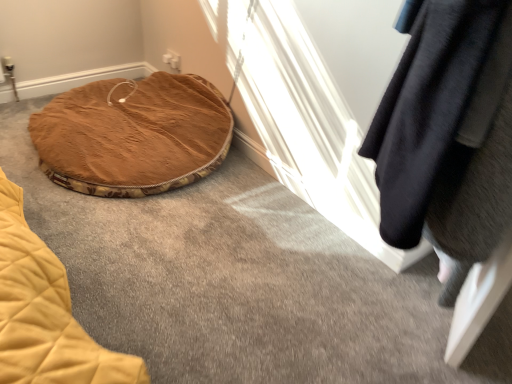
Question: In terms of height, does brown plush pet bed at lower left look taller or shorter compared to black fuzzy blanket at upper right?

Choices:
 (A) tall
 (B) short

Answer: (B)

Question: In terms of width, does brown plush pet bed at lower left look wider or thinner when compared to black fuzzy blanket at upper right?

Choices:
 (A) wide
 (B) thin

Answer: (A)

Question: Visually, is brown plush pet bed at lower left positioned to the left or to the right of black fuzzy blanket at upper right?

Choices:
 (A) left
 (B) right

Answer: (A)

Question: Choose the correct answer: Is black fuzzy blanket at upper right inside brown plush pet bed at lower left or outside it?

Choices:
 (A) inside
 (B) outside

Answer: (B)

Question: In terms of height, does black fuzzy blanket at upper right look taller or shorter compared to brown plush pet bed at lower left?

Choices:
 (A) short
 (B) tall

Answer: (B)

Question: Considering the positions of black fuzzy blanket at upper right and brown plush pet bed at lower left in the image, is black fuzzy blanket at upper right wider or thinner than brown plush pet bed at lower left?

Choices:
 (A) wide
 (B) thin

Answer: (B)

Question: Is point (460, 64) positioned closer to the camera than point (71, 92)?

Choices:
 (A) farther
 (B) closer

Answer: (B)